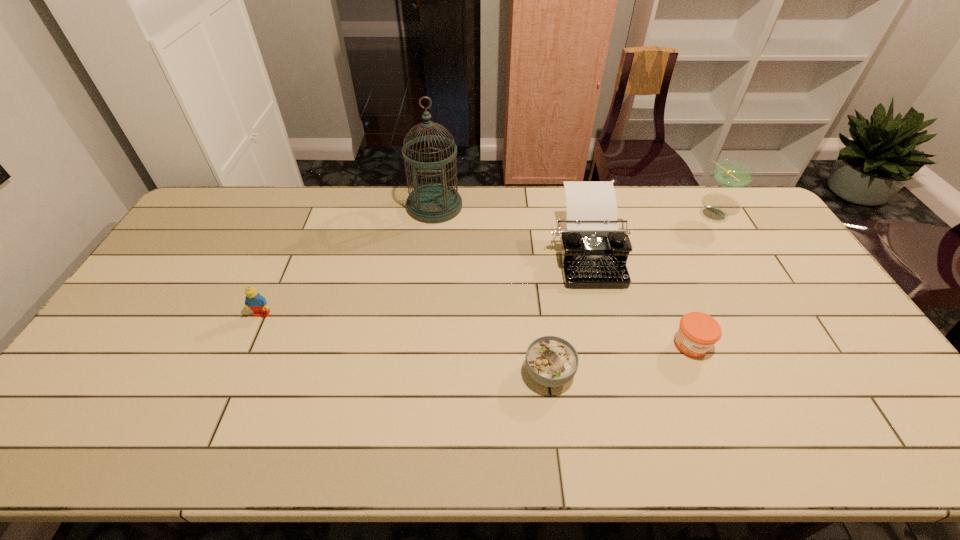
The image size is (960, 540). Identify the location of the tallest object. pyautogui.click(x=433, y=203).

At what (x,y) coordinates should I click in order to perform the action: click on birdcage. Please return your answer as a coordinate pair (x, y). The image size is (960, 540). Looking at the image, I should click on (433, 203).

The height and width of the screenshot is (540, 960). Find the location of `the fifth shortest object`. the fifth shortest object is located at coordinates (732, 173).

Where is `the rightmost object`? This screenshot has height=540, width=960. the rightmost object is located at coordinates (732, 173).

Find the location of a particular element. the fourth shortest object is located at coordinates (594, 252).

The height and width of the screenshot is (540, 960). In order to click on the fourth tallest object in this screenshot , I will do `click(257, 303)`.

Identify the location of the leftmost object. (257, 303).

Identify the location of the fifth object from left to right. (698, 332).

Where is `soup bowl`? The height and width of the screenshot is (540, 960). soup bowl is located at coordinates (551, 361).

At what (x,y) coordinates should I click in order to perform the action: click on vacant space located on the front-facing side of the tallest object. Please return your answer as a coordinate pair (x, y). The height and width of the screenshot is (540, 960). Looking at the image, I should click on (426, 280).